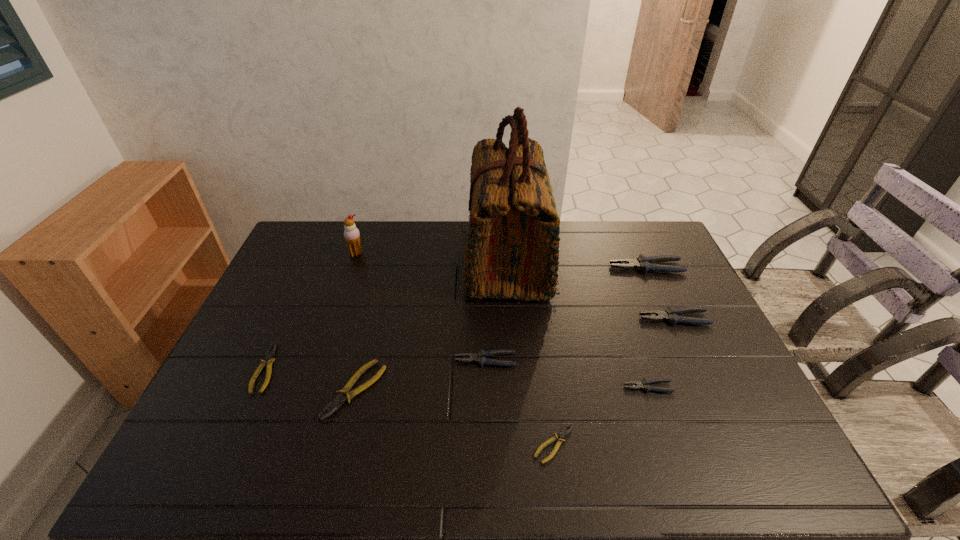
Image resolution: width=960 pixels, height=540 pixels. I want to click on object located at the far right corner, so click(x=643, y=263).

In the image, there is a desktop. Identify the location of vacant area at the far edge. (428, 227).

Identify the location of free spot at the left edge of the desktop. The image size is (960, 540). (299, 269).

You are a GUI agent. You are given a task and a screenshot of the screen. Output one action in this format:
    pyautogui.click(x=<x>, y=<y>)
    Task: Click on the free point at the far left corner
    
    Given the screenshot: What is the action you would take?
    pyautogui.click(x=318, y=226)

I want to click on vacant space at the far right corner of the desktop, so click(x=666, y=242).

Identify the location of unoccupied position between the third tallest object and the third object from left to right. [x=500, y=328].

Identify the location of vacant space in between the third object from left to right and the smallest yellow pliers. (454, 417).

Where is `blank region between the second tallest pliers and the seventh object from right to left`? Image resolution: width=960 pixels, height=540 pixels. blank region between the second tallest pliers and the seventh object from right to left is located at coordinates (515, 354).

Where is `free space between the leftmost object and the second pliers from left to right`? free space between the leftmost object and the second pliers from left to right is located at coordinates (311, 379).

Where is `vacant space that is in between the fifth shortest pliers and the second tallest object`? The image size is (960, 540). vacant space that is in between the fifth shortest pliers and the second tallest object is located at coordinates (420, 307).